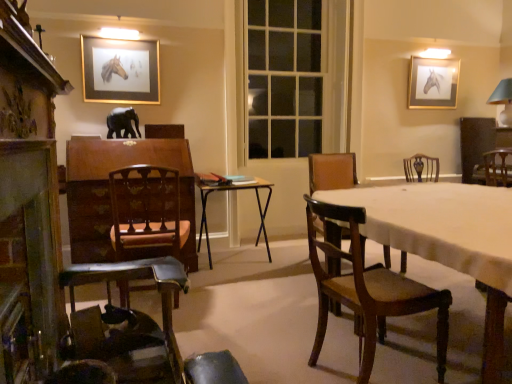
In order to face matte gray lampshade at upper right, should I rotate leftwards or rightwards?

Turn right by 30.768 degrees to look at matte gray lampshade at upper right.

Measure the distance between point (506,79) and camera.

Point (506,79) and camera are 4.90 meters apart.

What are the coordinates of `brown leather chair at center, the 4th chair positioned from the left` in the screenshot? It's located at (332, 171).

Describe the element at coordinates (122, 123) in the screenshot. I see `black matte elephant at center` at that location.

What is the approximate width of mahogany wood chair at center, arranged as the 3th chair when viewed from the left?

It is 20.51 inches.

I want to click on gold-framed picture of horse at upper right, marked as the second picture frame in a front-to-back arrangement, so click(x=433, y=83).

From the picture: Does brown wood armchair at center have a greater width compared to black matte elephant at center?

Yes, brown wood armchair at center is wider than black matte elephant at center.

From their relative heights in the image, would you say brown wood armchair at center is taller or shorter than black matte elephant at center?

Considering their sizes, brown wood armchair at center has less height than black matte elephant at center.

Are brown wood armchair at center and black matte elephant at center beside each other?

No, brown wood armchair at center is not next to black matte elephant at center.

Which object is positioned more to the left, white glass window at center or mahogany wood chair at center, the fifth chair in the back-to-front sequence?

white glass window at center is more to the left.

Can you confirm if white glass window at center is smaller than mahogany wood chair at center, the fifth chair in the back-to-front sequence?

Correct, white glass window at center occupies less space than mahogany wood chair at center, the fifth chair in the back-to-front sequence.

Considering the relative sizes of white glass window at center and mahogany wood chair at center, the fifth chair in the back-to-front sequence, in the image provided, is white glass window at center wider than mahogany wood chair at center, the fifth chair in the back-to-front sequence,?

Incorrect, the width of white glass window at center does not surpass that of mahogany wood chair at center, the fifth chair in the back-to-front sequence.

Considering the sizes of objects white glass window at center and mahogany wood chair at center, the 1th chair when ordered from front to back, in the image provided, who is shorter, white glass window at center or mahogany wood chair at center, the 1th chair when ordered from front to back,?

mahogany wood chair at center, the 1th chair when ordered from front to back.

Is mahogany wood chair at center, arranged as the 3th chair when viewed from the left, wider than wooden chair at left, placed as the first chair when sorted from left to right?

No.

Would you say mahogany wood chair at center, the 1th chair when ordered from front to back, is to the left or to the right of wooden chair at left, the fifth chair from the right, in the picture?

Based on their positions, mahogany wood chair at center, the 1th chair when ordered from front to back, is located to the right of wooden chair at left, the fifth chair from the right.

Could you tell me if mahogany wood chair at center, arranged as the third chair when viewed from the right, is facing wooden chair at left, the fifth chair from the right?

No, mahogany wood chair at center, arranged as the third chair when viewed from the right, is not turned towards wooden chair at left, the fifth chair from the right.

Is mahogany wood chair at center, arranged as the 3th chair when viewed from the left, outside of wooden chair at left, the fifth chair from the right?

Yes, mahogany wood chair at center, arranged as the 3th chair when viewed from the left, is located beyond the bounds of wooden chair at left, the fifth chair from the right.

Does point (123, 170) appear closer or farther from the camera than point (92, 274)?

Point (123, 170) is farther from the camera than point (92, 274).

Is wooden chair at left, placed as the first chair when sorted from left to right, not close to wooden chair at lower left, the 2th chair positioned from the left?

wooden chair at left, placed as the first chair when sorted from left to right, is actually quite close to wooden chair at lower left, the 2th chair positioned from the left.

Is wooden chair at lower left, the 2th chair in the front-to-back sequence, a part of wooden chair at left, marked as the 3th chair in a front-to-back arrangement?

That's incorrect, wooden chair at lower left, the 2th chair in the front-to-back sequence, is not inside wooden chair at left, marked as the 3th chair in a front-to-back arrangement.

Is wooden chair at left, placed as the first chair when sorted from left to right, positioned with its back to matte gray lampshade at upper right?

That's not correct — wooden chair at left, placed as the first chair when sorted from left to right, is not looking away from matte gray lampshade at upper right.

In terms of height, does wooden chair at left, marked as the 3th chair in a front-to-back arrangement, look taller or shorter compared to matte gray lampshade at upper right?

Considering their sizes, wooden chair at left, marked as the 3th chair in a front-to-back arrangement, has more height than matte gray lampshade at upper right.

Are wooden chair at left, the fifth chair from the right, and matte gray lampshade at upper right far apart?

wooden chair at left, the fifth chair from the right, is positioned a significant distance from matte gray lampshade at upper right.

Based on the photo, from the image's perspective, is gold-framed picture at upper center, the first picture frame from the front, positioned above or below brown leather chair at center, the 4th chair positioned from the left?

Clearly, from the image's perspective, gold-framed picture at upper center, the first picture frame from the front, is above brown leather chair at center, the 4th chair positioned from the left.

Considering the sizes of objects gold-framed picture at upper center, the first picture frame from the front, and brown leather chair at center, the second chair viewed from the right, in the image provided, who is smaller, gold-framed picture at upper center, the first picture frame from the front, or brown leather chair at center, the second chair viewed from the right,?

gold-framed picture at upper center, the first picture frame from the front.

Which is correct: gold-framed picture at upper center, the first picture frame from the front, is inside brown leather chair at center, the second chair in the back-to-front sequence, or outside of it?

The correct answer is: outside.

In the scene shown: Which object is thinner, metallic silver table at center or brown leather chair at center, the 4th chair positioned from the left?

brown leather chair at center, the 4th chair positioned from the left.

Based on the photo, is brown leather chair at center, positioned as the 4th chair in front-to-back order, inside metallic silver table at center?

No.

Is point (201, 227) farther from camera compared to point (381, 264)?

That is True.

From a real-world perspective, is metallic silver table at center located beneath brown leather chair at center, the second chair viewed from the right?

Yes, from a real-world perspective, metallic silver table at center is beneath brown leather chair at center, the second chair viewed from the right.

I want to click on animal that appears above the brown wood armchair at center (from the image's perspective), so click(122, 123).

The width and height of the screenshot is (512, 384). Find the location of `window on the left side of mahogany wood chair at center, the fifth chair in the back-to-front sequence`. window on the left side of mahogany wood chair at center, the fifth chair in the back-to-front sequence is located at coordinates (293, 77).

From the image, which object appears to be nearer to wooden chair at right, which is counted as the 5th chair, starting from the front, wooden chair at lower left, the fourth chair from the back, or white glass window at center?

white glass window at center is closer to wooden chair at right, which is counted as the 5th chair, starting from the front.

Which object lies nearer to the anchor point white glass window at center, wooden chair at right, positioned as the first chair in right-to-left order, or wooden mantelpiece at left?

wooden chair at right, positioned as the first chair in right-to-left order, is closer to white glass window at center.

Considering their positions, is wooden chair at lower left, the fourth chair from the back, positioned further to wooden chair at left, the fifth chair from the right, than matte gray lampshade at upper right?

matte gray lampshade at upper right is positioned further to the anchor wooden chair at left, the fifth chair from the right.

Which object lies nearer to the anchor point matte gray lampshade at upper right, wooden chair at right, which is counted as the 5th chair, starting from the front, or brown leather chair at center, the second chair viewed from the right?

Among the two, wooden chair at right, which is counted as the 5th chair, starting from the front, is located nearer to matte gray lampshade at upper right.

Considering their positions, is white glass window at center positioned closer to wooden chair at right, positioned as the first chair in right-to-left order, than gold-framed picture of horse at upper right, marked as the second picture frame in a front-to-back arrangement?

gold-framed picture of horse at upper right, marked as the second picture frame in a front-to-back arrangement, is closer to wooden chair at right, positioned as the first chair in right-to-left order.

Considering their positions, is wooden chair at right, the 5th chair from the left, positioned further to wooden chair at lower left, positioned as the fourth chair in right-to-left order, than matte gray lampshade at upper right?

matte gray lampshade at upper right lies further to wooden chair at lower left, positioned as the fourth chair in right-to-left order, than the other object.

Looking at the image, which one is located closer to wooden chair at lower left, positioned as the fourth chair in right-to-left order, wooden chair at right, which is counted as the 5th chair, starting from the front, or brown wood armchair at center?

Based on the image, brown wood armchair at center appears to be nearer to wooden chair at lower left, positioned as the fourth chair in right-to-left order.

Looking at the image, which one is located closer to matte gray lampshade at upper right, gold-framed picture of horse at upper right, which is the second picture frame from left to right, or wooden chair at right, the 5th chair from the left?

The object closer to matte gray lampshade at upper right is gold-framed picture of horse at upper right, which is the second picture frame from left to right.

The image size is (512, 384). Identify the location of window between wooden chair at lower left, the 2th chair positioned from the left, and wooden chair at right, which is counted as the 5th chair, starting from the front, in the horizontal direction. (293, 77).

You are a GUI agent. You are given a task and a screenshot of the screen. Output one action in this format:
    pyautogui.click(x=<x>, y=<y>)
    Task: Click on the window between wooden chair at left, the fifth chair from the right, and gold-framed picture of horse at upper right, marked as the second picture frame in a front-to-back arrangement, from left to right
    The image size is (512, 384).
    Given the screenshot: What is the action you would take?
    pyautogui.click(x=293, y=77)

Where is `animal positioned between mahogany wood chair at center, the 1th chair when ordered from front to back, and white glass window at center from near to far`? animal positioned between mahogany wood chair at center, the 1th chair when ordered from front to back, and white glass window at center from near to far is located at coordinates (122, 123).

Identify the location of table located between black matte elephant at center and brown leather chair at center, positioned as the 4th chair in front-to-back order, in the left-right direction. The image size is (512, 384). (234, 191).